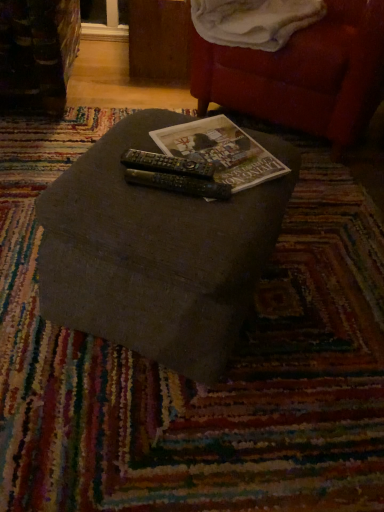
Identify the location of free space to the right of black plastic remote at center, arranged as the first remote when viewed from the front. The image size is (384, 512). click(x=249, y=197).